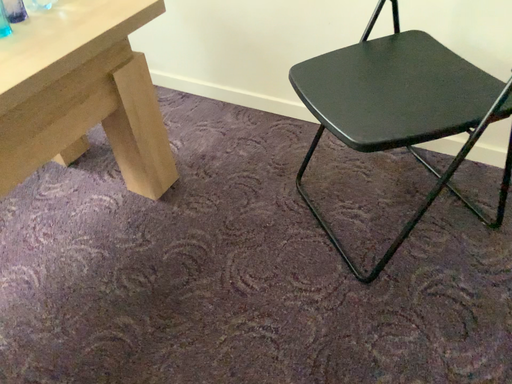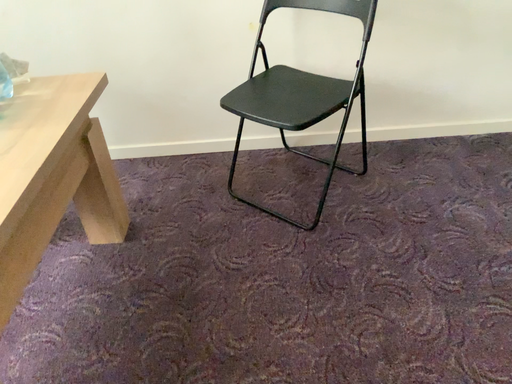
Question: Which way did the camera rotate in the video?

Choices:
 (A) rotated left
 (B) rotated right

Answer: (B)